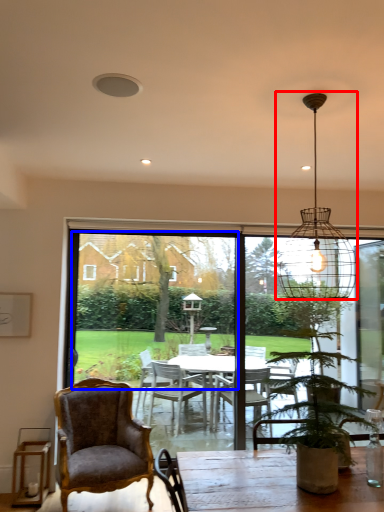
Question: Which point is further to the camera, light fixture (highlighted by a red box) or window screen (highlighted by a blue box)?

Choices:
 (A) light fixture
 (B) window screen

Answer: (B)